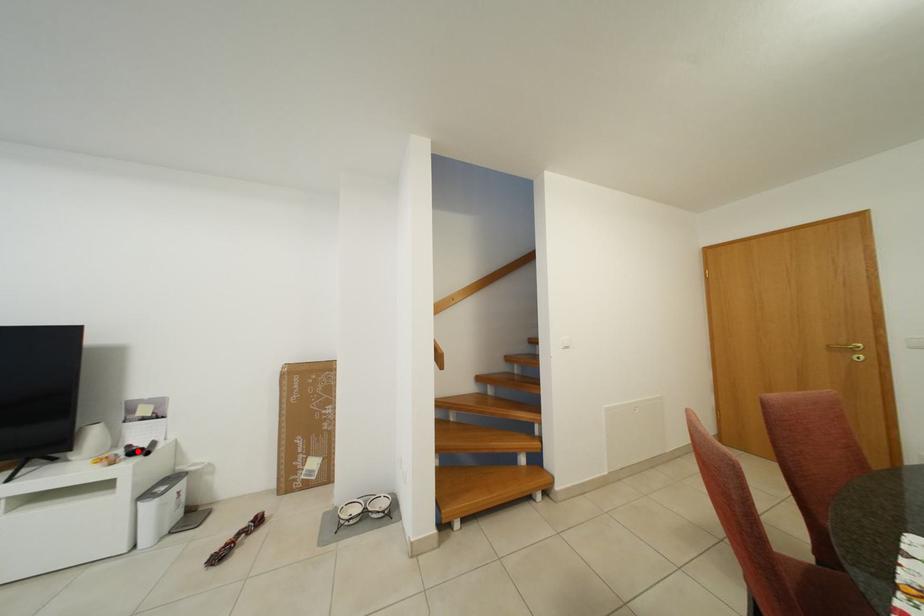
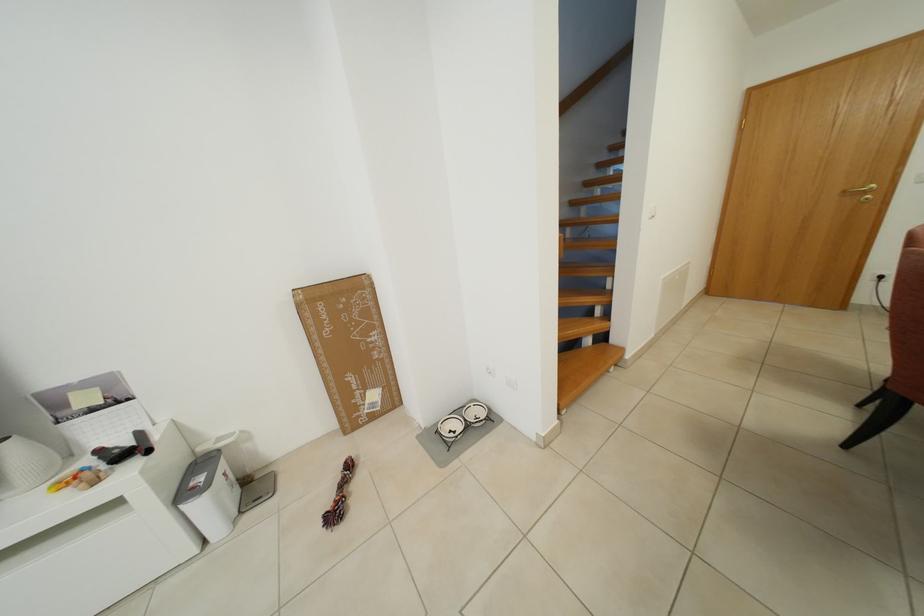
Question: I am providing you with two images of the same scene from different viewpoints. In image1, a red point is highlighted. Considering the same 3D point in image2, which of the following is correct?

Choices:
 (A) It is closer
 (B) It is farther

Answer: (B)